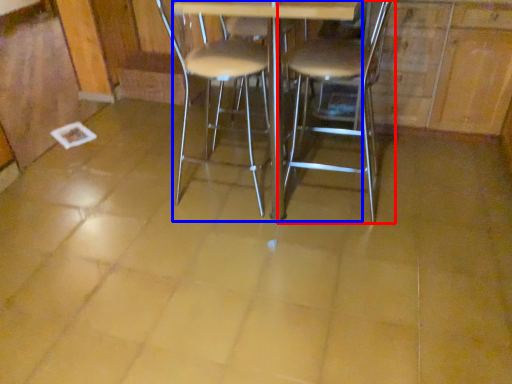
Question: Which of the following is the closest to the observer, chair (highlighted by a red box) or round table (highlighted by a blue box)?

Choices:
 (A) chair
 (B) round table

Answer: (B)